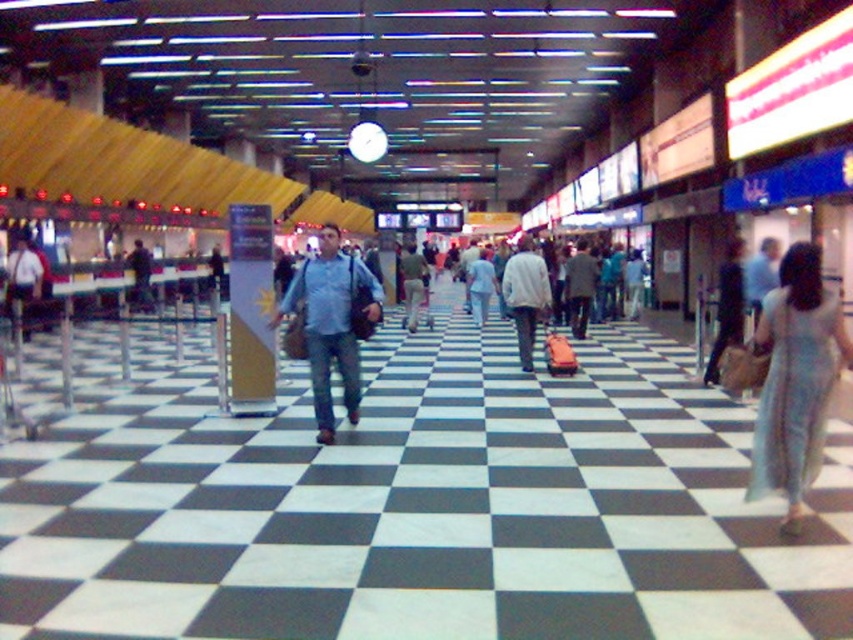
You are an airport security guard observing two people in the terminal. You notice a light blue dress at center and a light blue denim jeans at center. Which one is more to the left?

The light blue dress at center is more to the left side of the light blue denim jeans at center.

You are standing at the airport terminal described in the scene. There is a point marked at coordinates (x=795, y=380). What object is located at that point?

The point at coordinates (x=795, y=380) marks the location of the light blue dress at center.

You are standing at point A and want to walk to point B. The path between them is blocked by a large pillar. However, you notice two points marked in the scene. Point A is at point (527, 269) and point B is at point (724, 307). Which point should you choose to go around the pillar and reach your destination?

Point B at (724, 307) is in front of point A at (527, 269). To go around the pillar, you should choose point B as it is closer to your destination and not obstructed by the pillar.